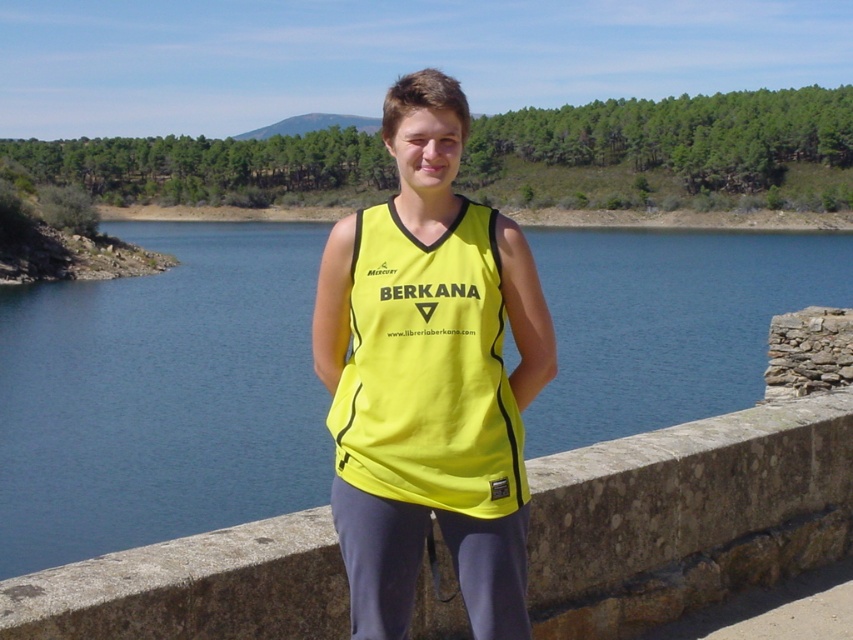
Question: Can you confirm if smooth stone ledge at center is smaller than yellow fabric safety vest at center?

Choices:
 (A) no
 (B) yes

Answer: (B)

Question: Estimate the real-world distances between objects in this image. Which object is farther from the smooth stone ledge at center?

Choices:
 (A) gray/textured leggings at center
 (B) blue water at center

Answer: (B)

Question: Can you confirm if blue water at center is thinner than gray/textured leggings at center?

Choices:
 (A) yes
 (B) no

Answer: (B)

Question: Does smooth stone ledge at center have a lesser width compared to gray/textured leggings at center?

Choices:
 (A) yes
 (B) no

Answer: (B)

Question: Which object is farther from the camera taking this photo?

Choices:
 (A) yellow fabric tank top at center
 (B) yellow fabric safety vest at center

Answer: (A)

Question: Which object appears farthest from the camera in this image?

Choices:
 (A) smooth stone ledge at center
 (B) yellow fabric tank top at center

Answer: (A)